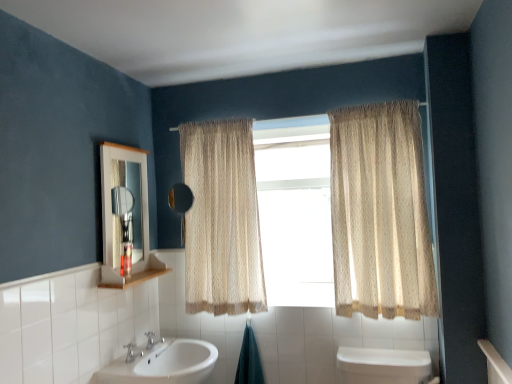
Question: Looking at the image, does white wood medicine cabinet at upper left seem bigger or smaller compared to beige textured curtain at right, acting as the first curtain starting from the right?

Choices:
 (A) big
 (B) small

Answer: (B)

Question: Considering the relative positions of white wood medicine cabinet at upper left and beige textured curtain at right, acting as the first curtain starting from the right, in the image provided, is white wood medicine cabinet at upper left to the left or to the right of beige textured curtain at right, acting as the first curtain starting from the right,?

Choices:
 (A) right
 (B) left

Answer: (B)

Question: Which object is the farthest from the teal fabric towel at lower center?

Choices:
 (A) silver metallic faucet at lower center
 (B) white tile at left
 (C) white wood medicine cabinet at upper left
 (D) translucent fabric curtain at center
 (E) white glossy sink at lower center

Answer: (B)

Question: Based on their relative distances, which object is farther from the teal fabric towel at lower center?

Choices:
 (A) white glossy sink at lower center
 (B) silver metallic faucet at lower center
 (C) white tile at left
 (D) black matte mirror at center
 (E) translucent fabric curtain at center

Answer: (C)